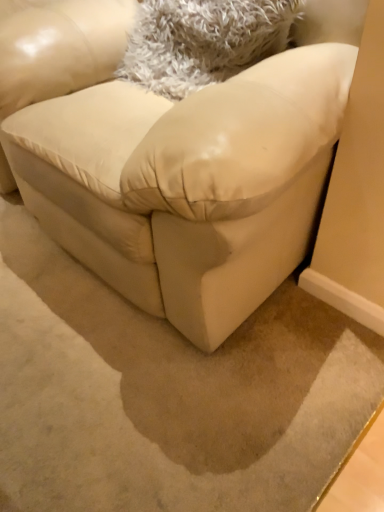
Question: Is matte cream couch at center in front of or behind white fluffy pillow at upper center in the image?

Choices:
 (A) front
 (B) behind

Answer: (A)

Question: Considering the relative positions of matte cream couch at center and white fluffy pillow at upper center in the image provided, is matte cream couch at center to the left or to the right of white fluffy pillow at upper center?

Choices:
 (A) left
 (B) right

Answer: (A)

Question: Choose the correct answer: Is matte cream couch at center inside white fluffy pillow at upper center or outside it?

Choices:
 (A) outside
 (B) inside

Answer: (A)

Question: Is point (283, 6) positioned closer to the camera than point (178, 145)?

Choices:
 (A) closer
 (B) farther

Answer: (B)

Question: Visually, is white fluffy pillow at upper center positioned to the left or to the right of matte cream couch at center?

Choices:
 (A) left
 (B) right

Answer: (B)

Question: From a real-world perspective, is white fluffy pillow at upper center above or below matte cream couch at center?

Choices:
 (A) above
 (B) below

Answer: (A)

Question: Considering the positions of white fluffy pillow at upper center and matte cream couch at center in the image, is white fluffy pillow at upper center taller or shorter than matte cream couch at center?

Choices:
 (A) short
 (B) tall

Answer: (A)